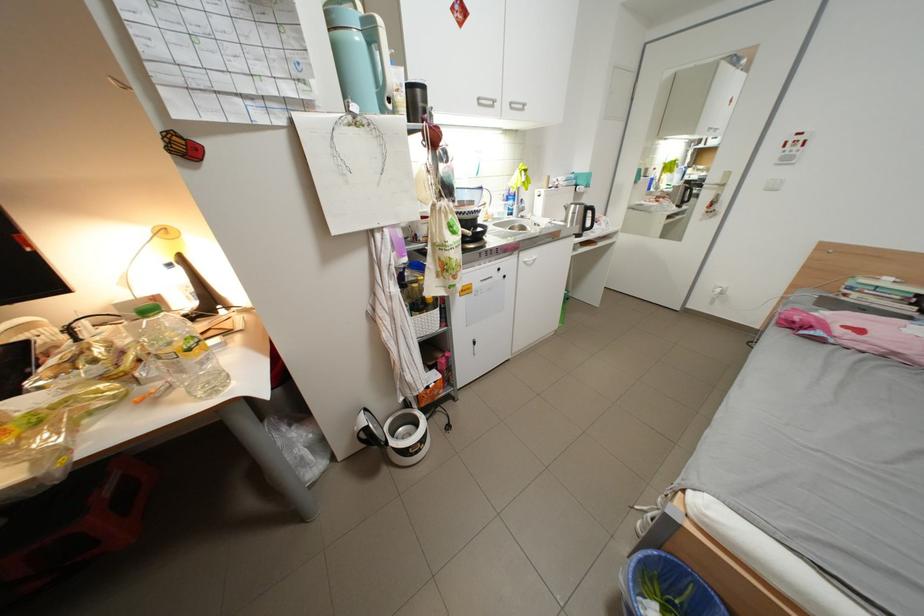
Where would you lift the black travel mug? Please return your answer as a coordinate pair (x, y).

(395, 435)